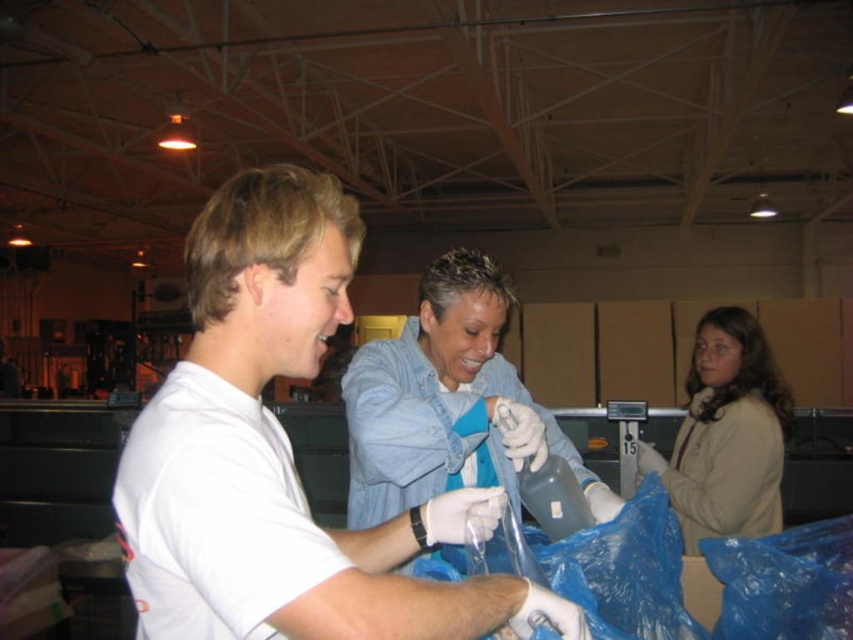
You are an observer in the warehouse. You see the white matte shirt at center and the white matte gloves at center. Which object takes up more horizontal space?

The white matte shirt at center might be wider than white matte gloves at center, so the white matte shirt at center likely takes up more horizontal space.